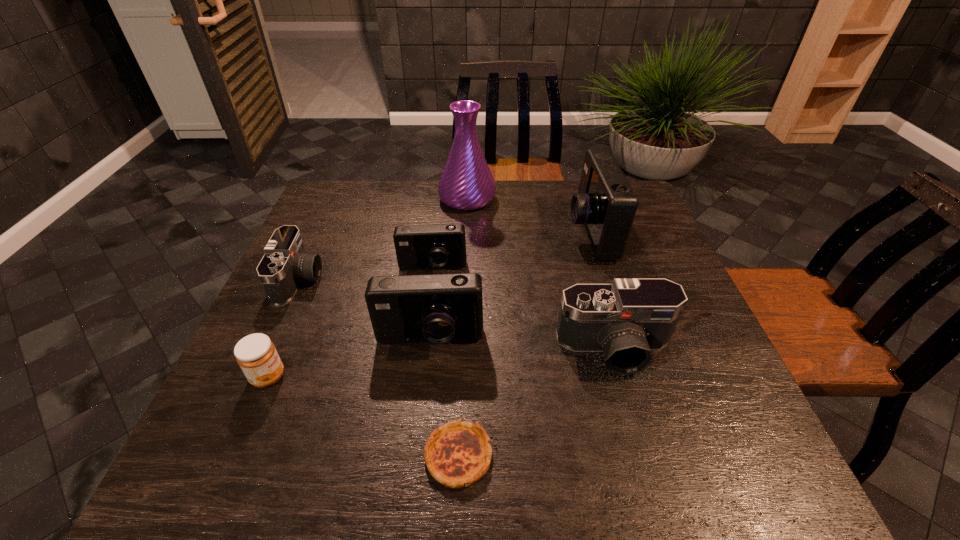
Find the location of `free spot that satisfies the following two spatial constraints: 1. on the front-facing side of the second smallest blue camera; 2. on the front label of the jam`. free spot that satisfies the following two spatial constraints: 1. on the front-facing side of the second smallest blue camera; 2. on the front label of the jam is located at coordinates (425, 377).

I want to click on free point that satisfies the following two spatial constraints: 1. on the front label of the quiche; 2. on the left side of the jam, so click(x=234, y=456).

Image resolution: width=960 pixels, height=540 pixels. I want to click on free space that satisfies the following two spatial constraints: 1. on the front-facing side of the shortest object; 2. on the left side of the farther black camera, so click(x=221, y=456).

Find the location of a particular element. vacant point that satisfies the following two spatial constraints: 1. on the back side of the shortest object; 2. on the front label of the orange jam is located at coordinates (461, 377).

This screenshot has width=960, height=540. I want to click on vacant region that satisfies the following two spatial constraints: 1. on the front-facing side of the smallest blue camera; 2. on the left side of the quiche, so click(409, 456).